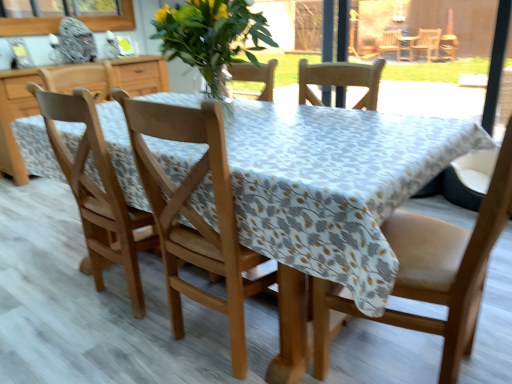
Question: From a real-world perspective, is clear glass window screen at upper left above or below wooden chair at center, marked as the 2th chair in a right-to-left arrangement?

Choices:
 (A) above
 (B) below

Answer: (A)

Question: Is clear glass window screen at upper left in front of or behind wooden chair at center, the 2th chair viewed from the left, in the image?

Choices:
 (A) behind
 (B) front

Answer: (A)

Question: Based on their relative distances, which object is nearer to the wooden chair at left, the 1th chair in the left-to-right sequence?

Choices:
 (A) wooden chair at center, the 2th chair viewed from the left
 (B) leather at right, placed as the first chair when sorted from right to left
 (C) clear glass window screen at upper left

Answer: (A)

Question: Based on their relative distances, which object is nearer to the leather at right, marked as the third chair in a left-to-right arrangement?

Choices:
 (A) clear glass window screen at upper left
 (B) wooden chair at center, marked as the 2th chair in a right-to-left arrangement
 (C) wooden chair at left, the 1th chair in the left-to-right sequence

Answer: (B)